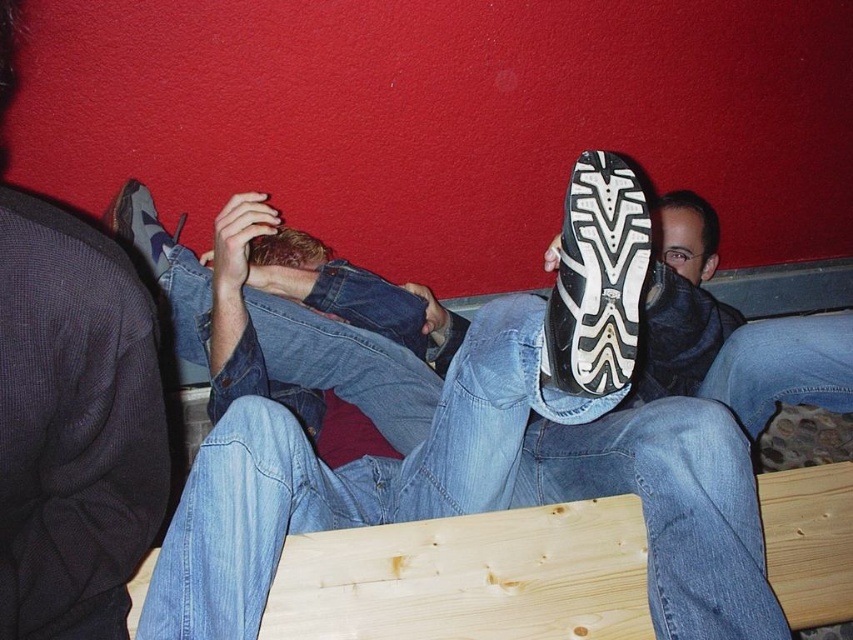
Can you confirm if matte black shoe at upper center is bigger than black rubber shoe at center?

Correct, matte black shoe at upper center is larger in size than black rubber shoe at center.

Who is lower down, matte black shoe at upper center or black rubber shoe at center?

Positioned lower is matte black shoe at upper center.

In the scene shown: Who is more distant from viewer, [701,634] or [633,246]?

The point [633,246] is behind.

Identify the location of matte black shoe at upper center. This screenshot has height=640, width=853. (432, 454).